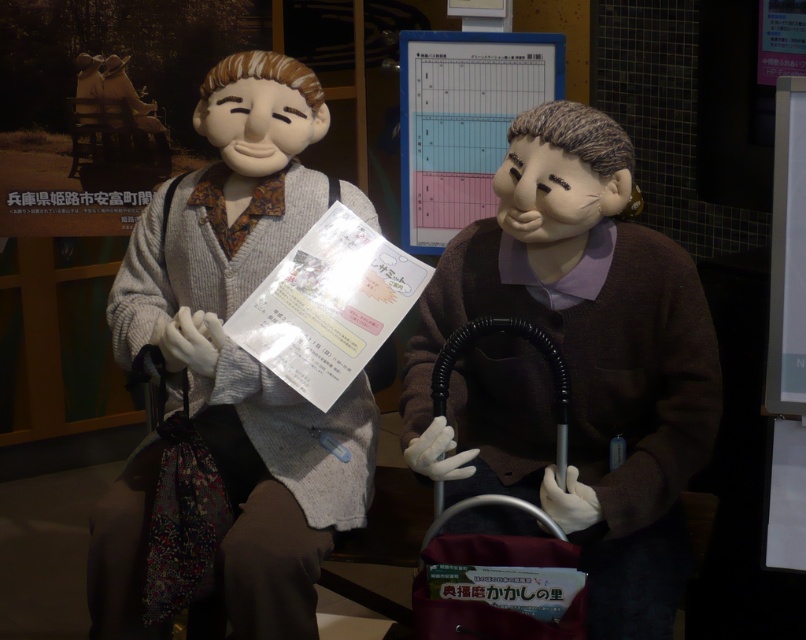
You are a visitor at the museum and want to take a photo of the brown matte sweater at center and the black rubber baby carriage at lower center. Which object should you focus on first if you want to capture both in the same frame without moving your camera?

The brown matte sweater at center is located above the black rubber baby carriage at lower center, so you should focus on the brown matte sweater at center first to ensure both are in the frame.

You are standing in front of two mannequins in a museum. You see the matte gray sweater at center and the matte gray sweater at left. Which one is closer to you?

The matte gray sweater at center is closer to the viewer than the matte gray sweater at left.